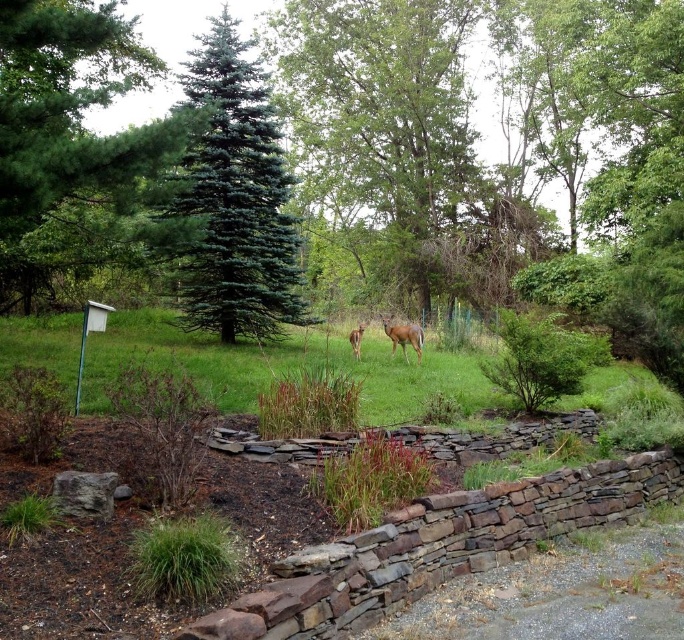
Question: Considering the real-world distances, which object is farthest from the blue-green coniferous tree at upper left?

Choices:
 (A) brown furry deer at center
 (B) brown matte/deer at center
 (C) green grass at center
 (D) green coniferous tree at left

Answer: (B)

Question: Which of the following is the closest to the observer?

Choices:
 (A) (174, 339)
 (B) (0, 100)
 (C) (356, 337)

Answer: (B)

Question: Considering the relative positions of green coniferous tree at left and brown furry deer at center in the image provided, where is green coniferous tree at left located with respect to brown furry deer at center?

Choices:
 (A) left
 (B) right

Answer: (A)

Question: Does blue-green coniferous tree at upper left have a larger size compared to brown matte/deer at center?

Choices:
 (A) no
 (B) yes

Answer: (B)

Question: Which object is farther from the camera taking this photo?

Choices:
 (A) brown furry deer at center
 (B) green grass at center
 (C) blue-green coniferous tree at upper left

Answer: (A)

Question: In this image, where is green coniferous tree at left located relative to brown furry deer at center?

Choices:
 (A) left
 (B) right

Answer: (A)